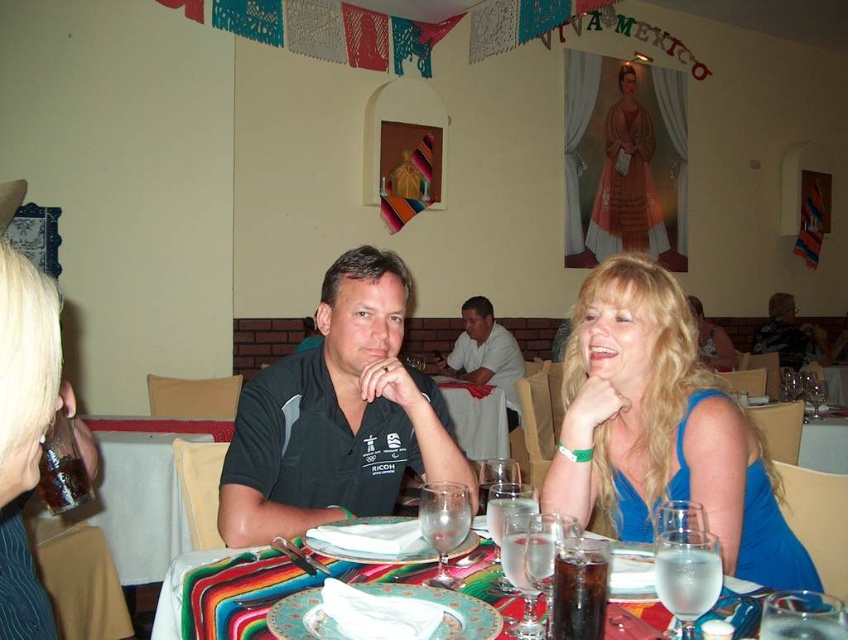
You are a photographer standing in front of the dining table. You want to take a photo of both the matte black shirt at center and the blue fabric dress at center. Which one will appear larger in the photo?

The matte black shirt at center will appear larger in the photo because it is closer to the viewer than the blue fabric dress at center.

You are a restaurant server and need to place a new menu on the table between the blue satin dress at center and the multicolored woven placemat at center. Which object should you place the menu closer to to ensure it fits properly?

The blue satin dress at center is narrower than the multicolored woven placemat at center, so placing the menu closer to the blue satin dress at center would allow more space for the placemat.